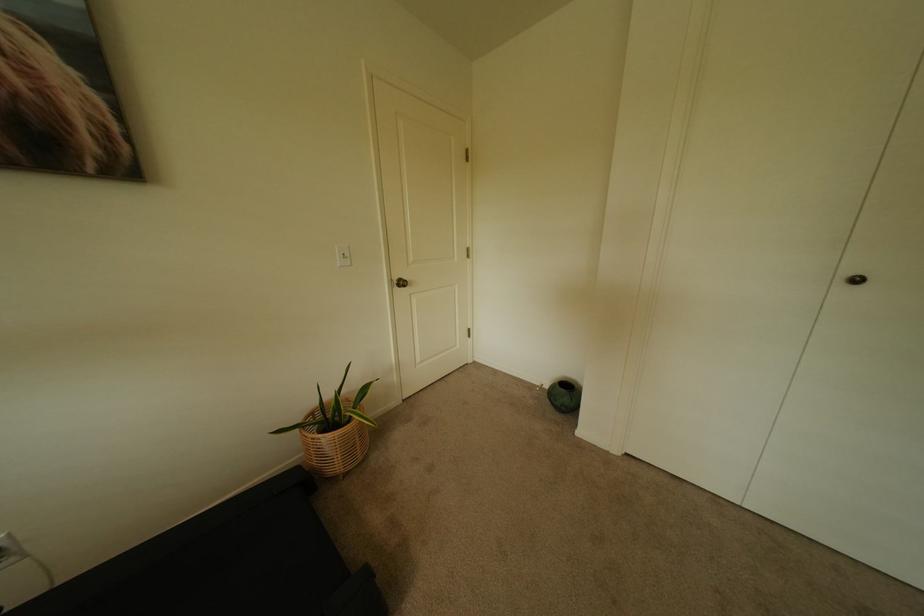
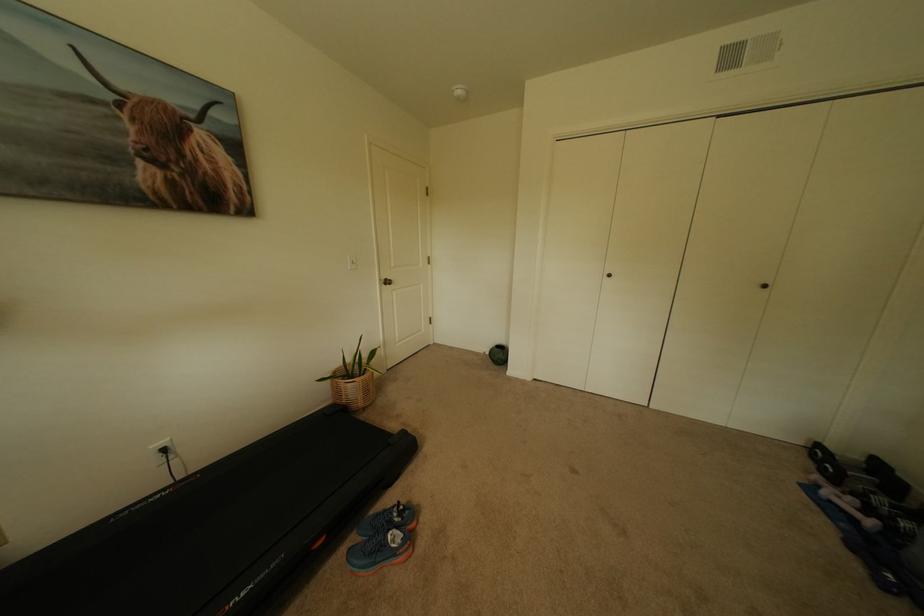
Question: The camera is either moving clockwise (left) or counter-clockwise (right) around the object. The first image is from the beginning of the video and the second image is from the end. Is the camera moving left or right when shooting the video?

Choices:
 (A) Left
 (B) Right

Answer: (A)